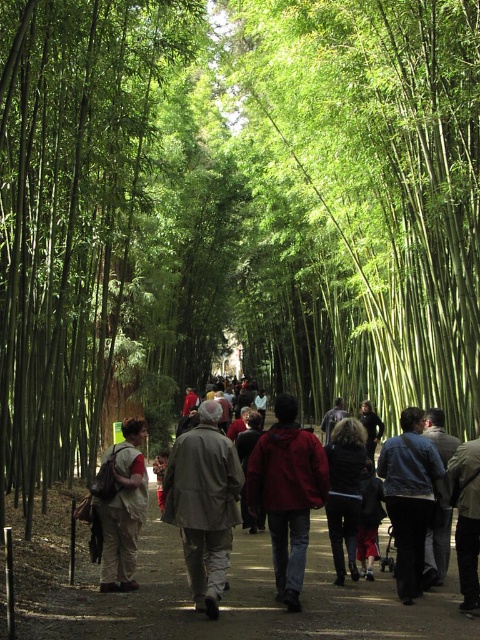
You are a hiker who just arrived at the bamboo grove pathway. You see a dark brown fur coat at center and a dark gray jacket at center. Which one is more to the left?

The dark brown fur coat at center is more to the left.

You are standing at the entrance of the bamboo grove pathway. You see two points marked on the ground ahead of you. The first point is at coordinates point (124,545) and the second is at point (432,554). If you want to reach the point that is closer to you, which one should you walk towards?

You should walk towards point (124,545) because it is closer to you than point (432,554).

You are a hiker carrying a light brown fabric coat at center and walking along the brown dirt path at center. Can you walk sideways while holding the coat without it touching the bamboo stalks on either side?

The brown dirt path at center is wider than the light brown fabric coat at center, so yes, you can walk sideways while holding the coat without it touching the bamboo stalks on either side.